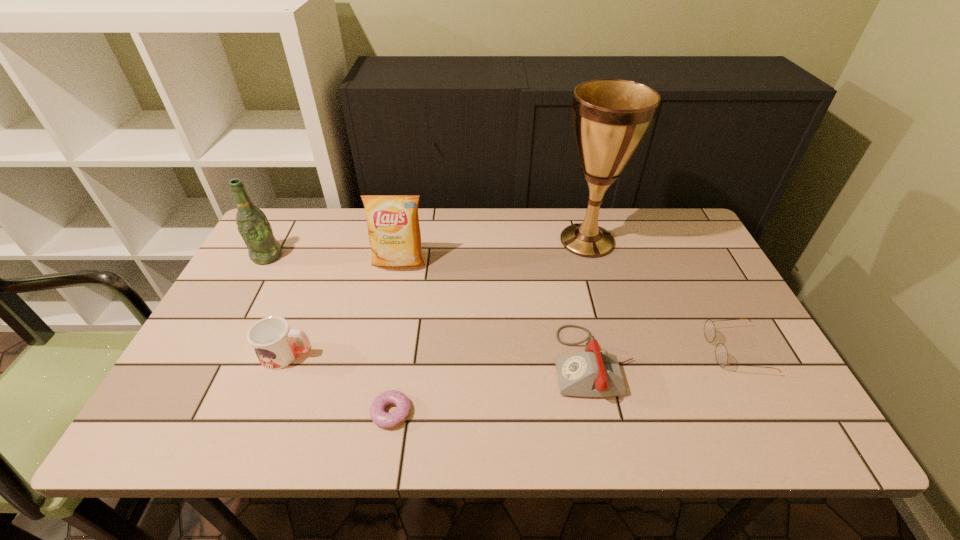
At what (x,y) coordinates should I click in order to perform the action: click on the tallest object. Please return your answer as a coordinate pair (x, y). This screenshot has height=540, width=960. Looking at the image, I should click on (611, 117).

Locate an element on the screen. Image resolution: width=960 pixels, height=540 pixels. beer bottle is located at coordinates (253, 226).

Identify the location of the second tallest object. This screenshot has width=960, height=540. (253, 226).

At what (x,y) coordinates should I click in order to perform the action: click on the third tallest object. Please return your answer as a coordinate pair (x, y). Looking at the image, I should click on (394, 233).

Locate an element on the screen. the fourth shortest object is located at coordinates (272, 340).

Locate an element on the screen. mug is located at coordinates (272, 340).

Identify the location of telephone. [593, 373].

Find the location of `the rightmost object`. the rightmost object is located at coordinates (721, 354).

At what (x,y) coordinates should I click in order to perform the action: click on spectacles. Please return your answer as a coordinate pair (x, y). This screenshot has width=960, height=540. Looking at the image, I should click on (721, 354).

Where is `doughnut`? Image resolution: width=960 pixels, height=540 pixels. doughnut is located at coordinates (378, 415).